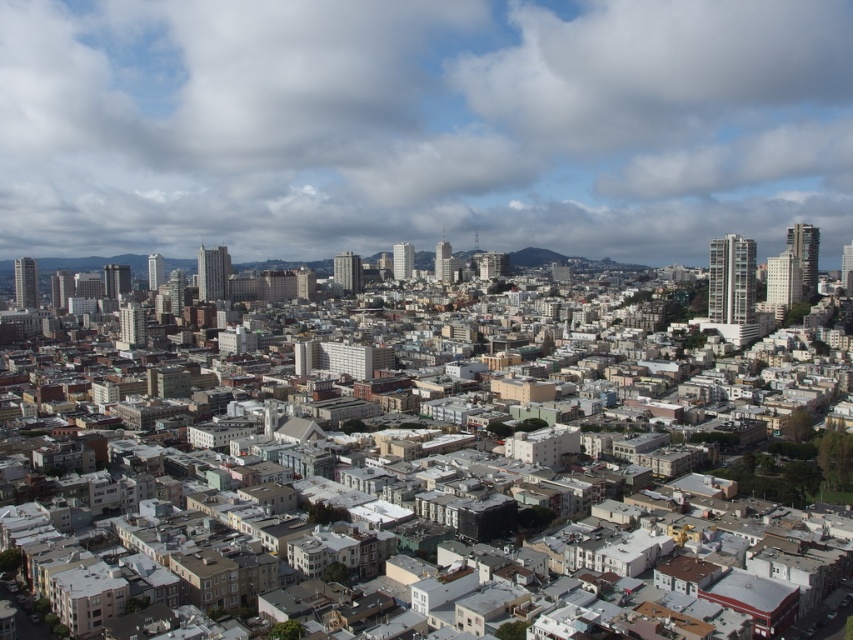
Question: Does white fluffy cloud at upper center appear over green grassy hillside at center?

Choices:
 (A) no
 (B) yes

Answer: (B)

Question: Does white fluffy cloud at upper center appear on the right side of green grassy hillside at center?

Choices:
 (A) yes
 (B) no

Answer: (B)

Question: Which of the following is the farthest from the observer?

Choices:
 (A) green grassy hillside at center
 (B) white fluffy cloud at upper center

Answer: (B)

Question: Among these objects, which one is farthest from the camera?

Choices:
 (A) green grassy hillside at center
 (B) white fluffy cloud at upper center

Answer: (B)

Question: In this image, where is white fluffy cloud at upper center located relative to green grassy hillside at center?

Choices:
 (A) left
 (B) right

Answer: (A)